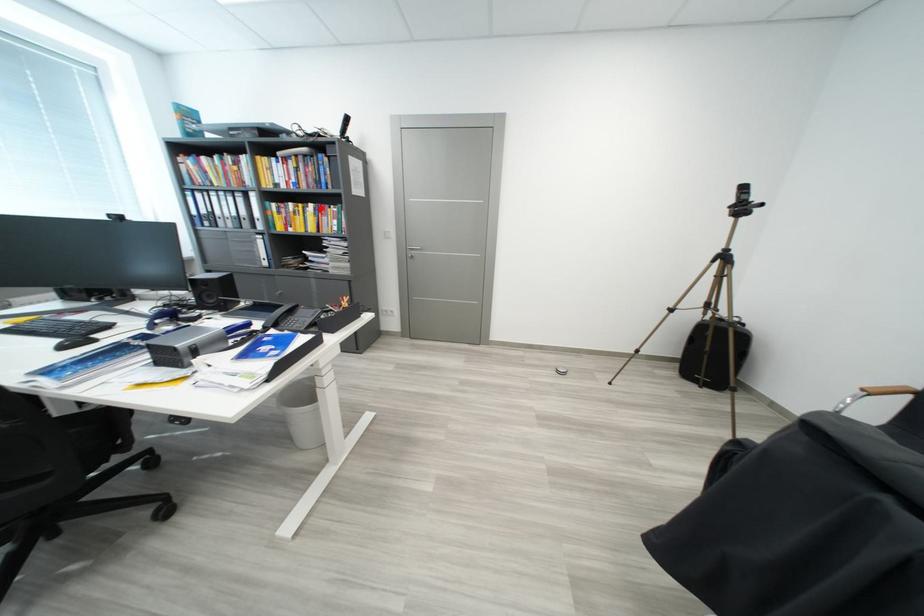
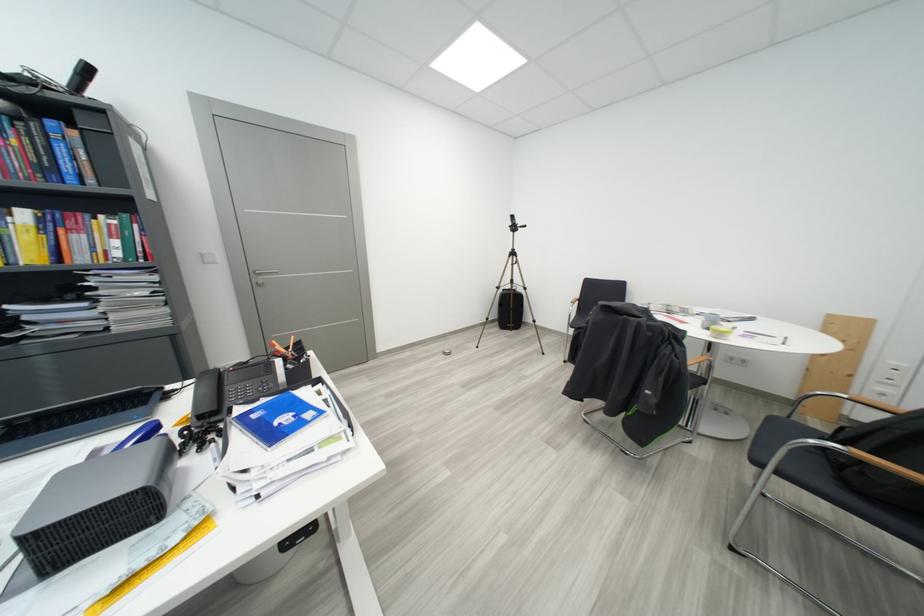
In the second image, find the point that corresponds to the highlighted location in the first image.

(32, 216)